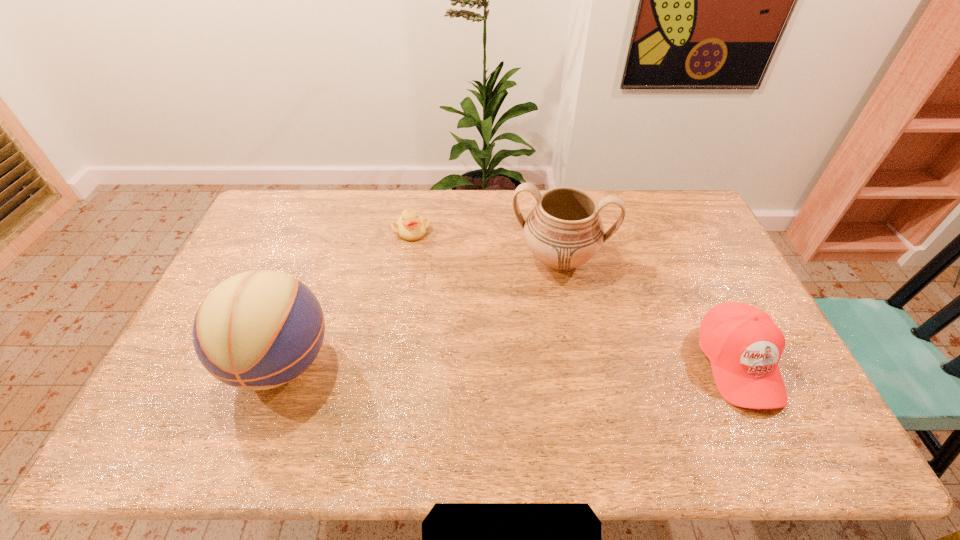
In the image, there is a desktop. Where is `vacant area at the near edge`? The width and height of the screenshot is (960, 540). vacant area at the near edge is located at coordinates (348, 410).

In order to click on free space at the left edge of the desktop in this screenshot , I will do `click(291, 234)`.

Where is `vacant area between the duckling and the urn`? This screenshot has height=540, width=960. vacant area between the duckling and the urn is located at coordinates (486, 245).

Where is `free space between the second shortest object and the second object from right to left`? free space between the second shortest object and the second object from right to left is located at coordinates (648, 311).

Where is `free space between the third object from right to left and the second object from right to left`? free space between the third object from right to left and the second object from right to left is located at coordinates pos(486,245).

The height and width of the screenshot is (540, 960). I want to click on vacant area that lies between the third object from right to left and the second object from right to left, so click(x=486, y=245).

The image size is (960, 540). What are the coordinates of `vacant area between the baseball cap and the urn` in the screenshot? It's located at (648, 311).

The image size is (960, 540). I want to click on vacant area between the second shortest object and the shortest object, so click(x=575, y=297).

The width and height of the screenshot is (960, 540). In order to click on free spot between the third object from left to right and the basketball in this screenshot , I will do `click(420, 310)`.

At what (x,y) coordinates should I click in order to perform the action: click on vacant space in between the shortest object and the baseball cap. Please return your answer as a coordinate pair (x, y). Image resolution: width=960 pixels, height=540 pixels. Looking at the image, I should click on (x=575, y=297).